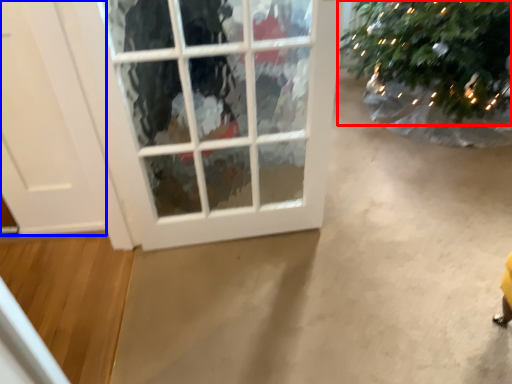
Question: Which object appears closest to the camera in this image, christmas tree (highlighted by a red box) or door (highlighted by a blue box)?

Choices:
 (A) christmas tree
 (B) door

Answer: (B)